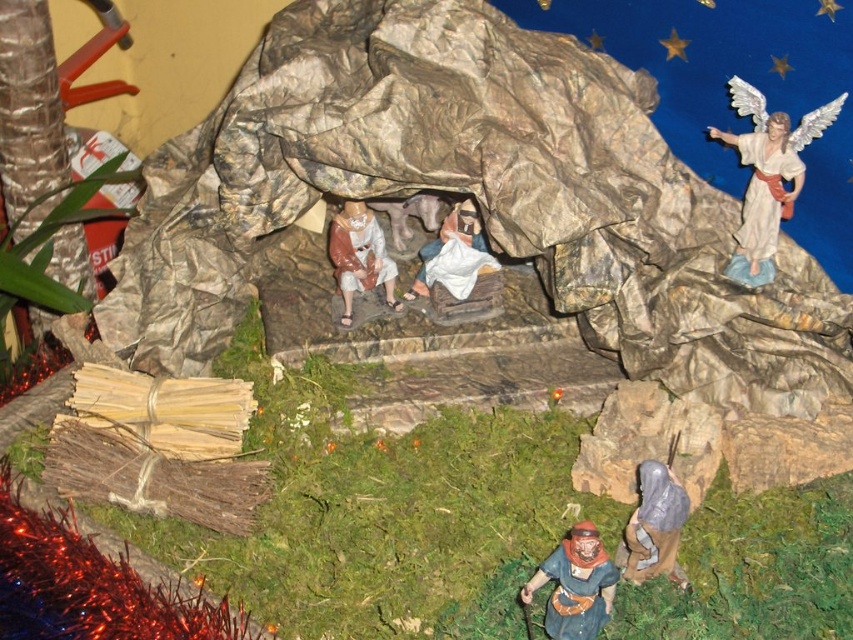
Question: Considering the relative positions of white glossy angel at upper right and gray fabric figure at lower right in the image provided, where is white glossy angel at upper right located with respect to gray fabric figure at lower right?

Choices:
 (A) above
 (B) below

Answer: (A)

Question: Which point is closer to the camera?

Choices:
 (A) brown painted wood figure at lower center
 (B) white cloth at center
 (C) smooth beige robe at center

Answer: (A)

Question: Among these points, which one is farthest from the camera?

Choices:
 (A) (763, 172)
 (B) (357, 284)

Answer: (B)

Question: Is white glossy angel at upper right thinner than gray fabric figure at lower right?

Choices:
 (A) yes
 (B) no

Answer: (B)

Question: Among these objects, which one is farthest from the camera?

Choices:
 (A) white cloth at center
 (B) gray fabric figure at lower right
 (C) smooth beige robe at center
 (D) brown painted wood figure at lower center

Answer: (A)

Question: Can you confirm if white glossy angel at upper right is bigger than brown painted wood figure at lower center?

Choices:
 (A) no
 (B) yes

Answer: (B)